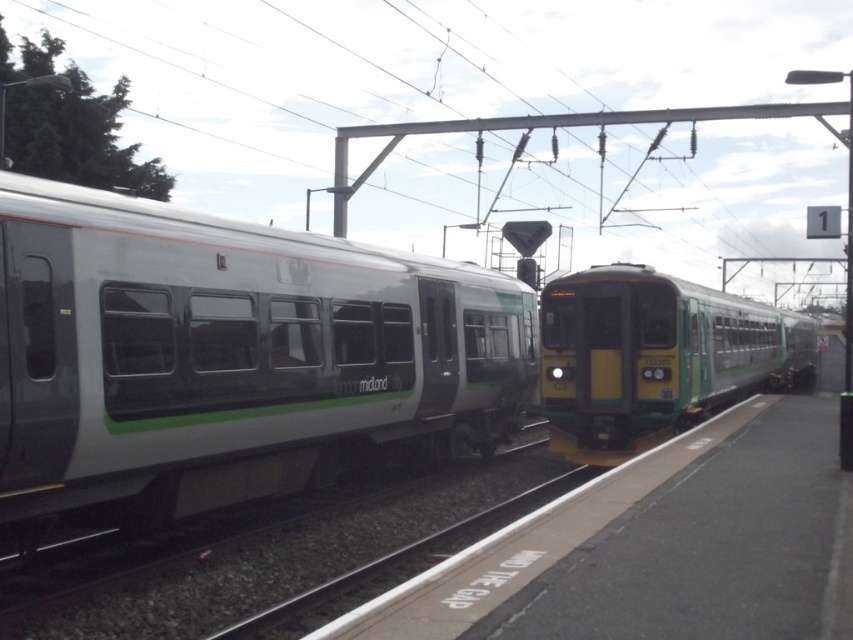
Does silver/grey metallic train at left appear on the left side of green/yellow plastic train at center?

Correct, you'll find silver/grey metallic train at left to the left of green/yellow plastic train at center.

Does silver/grey metallic train at left have a greater width compared to green/yellow plastic train at center?

No, silver/grey metallic train at left is not wider than green/yellow plastic train at center.

Identify the location of silver/grey metallic train at left. (228, 356).